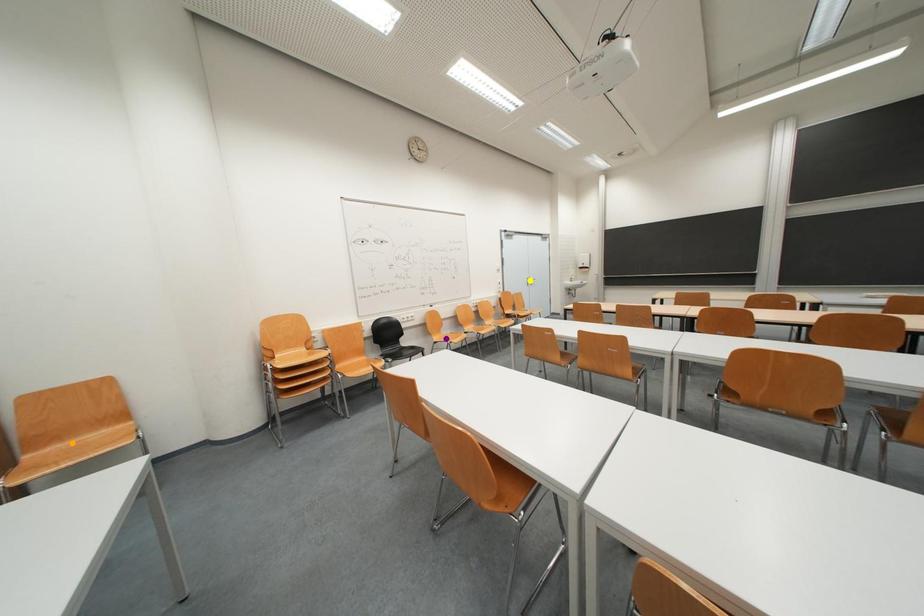
Order these from farthest to nearest:
yellow point
orange point
purple point

yellow point
purple point
orange point